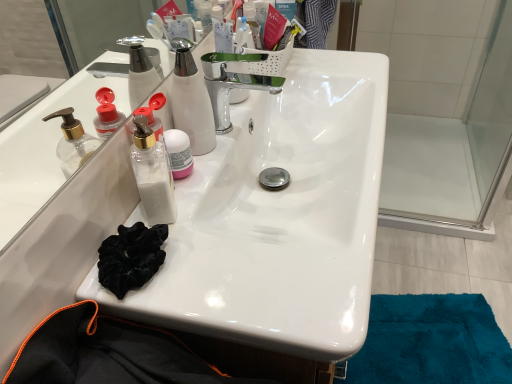
The image size is (512, 384). What are the coordinates of `white matte jar at center, the 1th bottle when ordered from right to left` in the screenshot? It's located at (179, 153).

Describe the element at coordinates (179, 153) in the screenshot. This screenshot has height=384, width=512. I see `white matte jar at center, the 1th bottle when ordered from right to left` at that location.

What is the approximate width of white matte jar at center, which is the 2th bottle in left-to-right order?

white matte jar at center, which is the 2th bottle in left-to-right order, is 5.21 centimeters wide.

How much space does transparent plastic pump bottle at center, positioned as the 2th bottle in right-to-left order, occupy horizontally?

2.05 inches.

You are a GUI agent. You are given a task and a screenshot of the screen. Output one action in this format:
    pyautogui.click(x=<x>, y=<y>)
    Task: Click on the transparent plastic pump bottle at center, positioned as the 2th bottle in right-to-left order
    The image size is (512, 384).
    Given the screenshot: What is the action you would take?
    pyautogui.click(x=152, y=174)

Image resolution: width=512 pixels, height=384 pixels. Describe the element at coordinates (152, 174) in the screenshot. I see `transparent plastic pump bottle at center, positioned as the 2th bottle in right-to-left order` at that location.

The height and width of the screenshot is (384, 512). Identify the location of white matte jar at center, the 1th bottle when ordered from right to left. [179, 153].

Is white matte jar at center, the 1th bottle when ordered from right to left, at the right side of transparent plastic pump bottle at center, positioned as the 2th bottle in right-to-left order?

Indeed, white matte jar at center, the 1th bottle when ordered from right to left, is positioned on the right side of transparent plastic pump bottle at center, positioned as the 2th bottle in right-to-left order.

Considering their positions, is white matte jar at center, which is the 2th bottle in left-to-right order, located in front of or behind transparent plastic pump bottle at center, the first bottle positioned from the left?

In the image, white matte jar at center, which is the 2th bottle in left-to-right order, appears behind transparent plastic pump bottle at center, the first bottle positioned from the left.

Is point (186, 166) behind point (135, 115)?

Yes, point (186, 166) is behind point (135, 115).

From the image's perspective, would you say white matte jar at center, the 1th bottle when ordered from right to left, is positioned over transparent plastic pump bottle at center, the first bottle positioned from the left?

Indeed, from the image's perspective, white matte jar at center, the 1th bottle when ordered from right to left, is shown above transparent plastic pump bottle at center, the first bottle positioned from the left.

Consider the image. From a real-world perspective, which object stands above the other?

transparent plastic pump bottle at center, positioned as the 2th bottle in right-to-left order.

Considering the sizes of objects white matte jar at center, the 1th bottle when ordered from right to left, and transparent plastic pump bottle at center, the first bottle positioned from the left, in the image provided, who is wider, white matte jar at center, the 1th bottle when ordered from right to left, or transparent plastic pump bottle at center, the first bottle positioned from the left,?

transparent plastic pump bottle at center, the first bottle positioned from the left, is wider.

Is white matte jar at center, the 1th bottle when ordered from right to left, taller than transparent plastic pump bottle at center, positioned as the 2th bottle in right-to-left order?

No, white matte jar at center, the 1th bottle when ordered from right to left, is not taller than transparent plastic pump bottle at center, positioned as the 2th bottle in right-to-left order.

Does white matte jar at center, which is the 2th bottle in left-to-right order, have a larger size compared to transparent plastic pump bottle at center, positioned as the 2th bottle in right-to-left order?

Incorrect, white matte jar at center, which is the 2th bottle in left-to-right order, is not larger than transparent plastic pump bottle at center, positioned as the 2th bottle in right-to-left order.

Choose the correct answer: Is white matte jar at center, the 1th bottle when ordered from right to left, inside transparent plastic pump bottle at center, the first bottle positioned from the left, or outside it?

white matte jar at center, the 1th bottle when ordered from right to left, is located beyond the bounds of transparent plastic pump bottle at center, the first bottle positioned from the left.

Consider the image. Is the surface of white matte jar at center, which is the 2th bottle in left-to-right order, in direct contact with transparent plastic pump bottle at center, the first bottle positioned from the left?

Yes, white matte jar at center, which is the 2th bottle in left-to-right order, is right next to transparent plastic pump bottle at center, the first bottle positioned from the left, and making contact.

Could you tell me if white matte jar at center, which is the 2th bottle in left-to-right order, is facing transparent plastic pump bottle at center, positioned as the 2th bottle in right-to-left order?

No.

At what (x,y) coordinates should I click in order to perform the action: click on bottle in front of the white matte jar at center, the 1th bottle when ordered from right to left. Please return your answer as a coordinate pair (x, y). Image resolution: width=512 pixels, height=384 pixels. Looking at the image, I should click on (152, 174).

Which object is positioned more to the right, transparent plastic pump bottle at center, positioned as the 2th bottle in right-to-left order, or white matte jar at center, the 1th bottle when ordered from right to left?

From the viewer's perspective, white matte jar at center, the 1th bottle when ordered from right to left, appears more on the right side.

Between transparent plastic pump bottle at center, the first bottle positioned from the left, and white matte jar at center, which is the 2th bottle in left-to-right order, which one is positioned in front?

transparent plastic pump bottle at center, the first bottle positioned from the left, is in front.

Is point (160, 214) closer to camera compared to point (177, 132)?

That is True.

From the image's perspective, which is above, transparent plastic pump bottle at center, positioned as the 2th bottle in right-to-left order, or white matte jar at center, which is the 2th bottle in left-to-right order?

white matte jar at center, which is the 2th bottle in left-to-right order, is shown above in the image.

From a real-world perspective, who is located lower, transparent plastic pump bottle at center, the first bottle positioned from the left, or white matte jar at center, the 1th bottle when ordered from right to left?

In real-world perspective, white matte jar at center, the 1th bottle when ordered from right to left, is lower.

Looking at their sizes, would you say transparent plastic pump bottle at center, the first bottle positioned from the left, is wider or thinner than white matte jar at center, which is the 2th bottle in left-to-right order?

transparent plastic pump bottle at center, the first bottle positioned from the left, is wider than white matte jar at center, which is the 2th bottle in left-to-right order.

Between transparent plastic pump bottle at center, the first bottle positioned from the left, and white matte jar at center, which is the 2th bottle in left-to-right order, which one has more height?

transparent plastic pump bottle at center, the first bottle positioned from the left, is taller.

Considering the sizes of objects transparent plastic pump bottle at center, positioned as the 2th bottle in right-to-left order, and white matte jar at center, the 1th bottle when ordered from right to left, in the image provided, who is smaller, transparent plastic pump bottle at center, positioned as the 2th bottle in right-to-left order, or white matte jar at center, the 1th bottle when ordered from right to left,?

With smaller size is white matte jar at center, the 1th bottle when ordered from right to left.

Which is correct: transparent plastic pump bottle at center, positioned as the 2th bottle in right-to-left order, is inside white matte jar at center, which is the 2th bottle in left-to-right order, or outside of it?

The correct answer is: outside.

Is there a large distance between transparent plastic pump bottle at center, positioned as the 2th bottle in right-to-left order, and white matte jar at center, which is the 2th bottle in left-to-right order?

transparent plastic pump bottle at center, positioned as the 2th bottle in right-to-left order, is actually quite close to white matte jar at center, which is the 2th bottle in left-to-right order.

Is transparent plastic pump bottle at center, the first bottle positioned from the left, looking in the opposite direction of white matte jar at center, the 1th bottle when ordered from right to left?

No, transparent plastic pump bottle at center, the first bottle positioned from the left,'s orientation is not away from white matte jar at center, the 1th bottle when ordered from right to left.

At what (x,y) coordinates should I click in order to perform the action: click on bottle behind the transparent plastic pump bottle at center, positioned as the 2th bottle in right-to-left order. Please return your answer as a coordinate pair (x, y). The height and width of the screenshot is (384, 512). Looking at the image, I should click on (179, 153).

This screenshot has width=512, height=384. I want to click on bottle located below the white matte jar at center, the 1th bottle when ordered from right to left (from the image's perspective), so click(152, 174).

Locate an element on the screen. This screenshot has width=512, height=384. bottle on the right of transparent plastic pump bottle at center, positioned as the 2th bottle in right-to-left order is located at coordinates (179, 153).